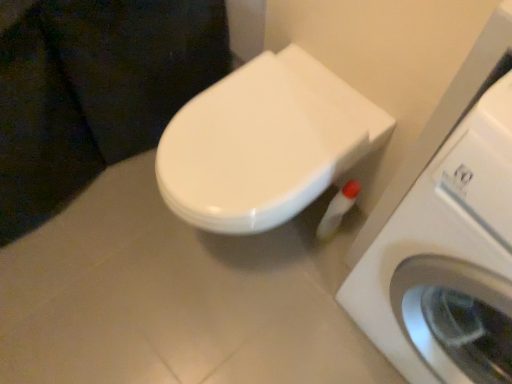
Question: From the image's perspective, is white glossy toilet at center above or below white glossy toilet paper at lower right?

Choices:
 (A) above
 (B) below

Answer: (A)

Question: Relative to white glossy toilet paper at lower right, is white glossy toilet at center in front or behind?

Choices:
 (A) behind
 (B) front

Answer: (B)

Question: Based on their relative distances, which object is farther from the white glossy toilet at center?

Choices:
 (A) white glossy toilet paper at lower right
 (B) white plastic washing machine at right

Answer: (A)

Question: Estimate the real-world distances between objects in this image. Which object is farther from the white glossy toilet paper at lower right?

Choices:
 (A) white glossy toilet at center
 (B) white plastic washing machine at right

Answer: (B)